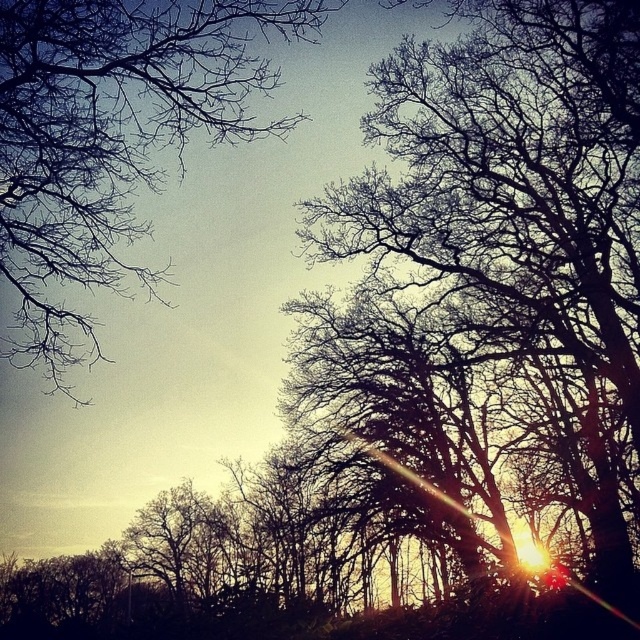
You are a photographer standing at the camera position. You want to capture a closeup shot of the silhouette bare branches at center. Given that your camera can focus on objects within 10 meters, will you be able to take the photo without moving closer?

The silhouette bare branches at center is 13.83 meters from the camera, which is beyond the 10 meters focus range. Therefore, you cannot take the closeup shot without moving closer.

You are an artist sketching the winter scene. You want to focus on the silhouette bare branches at center and the bare branches at upper left. Which of these two has a smaller visual footprint in the image?

The silhouette bare branches at center occupies less space than the bare branches at upper left, so the silhouette bare branches at center has a smaller visual footprint.